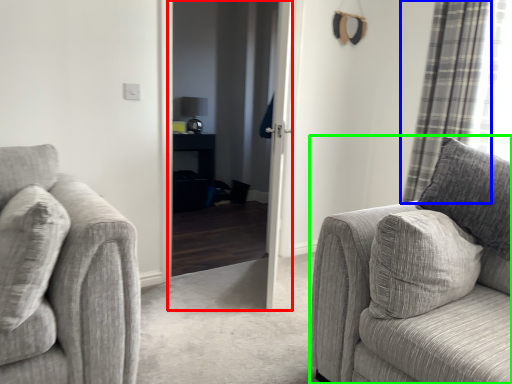
Question: Which object is positioned farthest from screen door (highlighted by a red box)? Select from curtain (highlighted by a blue box) and studio couch (highlighted by a green box).

Choices:
 (A) curtain
 (B) studio couch

Answer: (B)